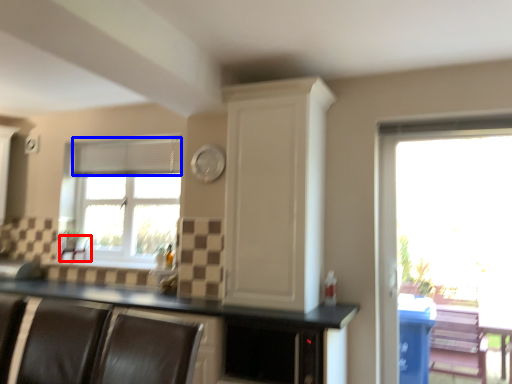
Question: Which object is closer to the camera taking this photo, armchair (highlighted by a red box) or blind (highlighted by a blue box)?

Choices:
 (A) armchair
 (B) blind

Answer: (B)